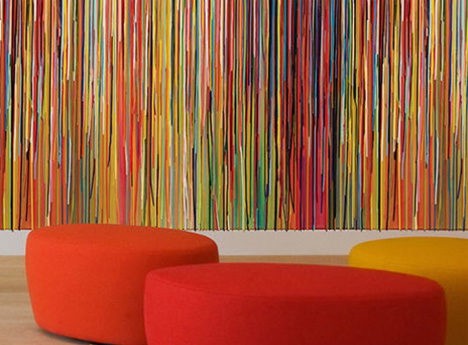
Where is `rainbow curtain`? The width and height of the screenshot is (468, 345). rainbow curtain is located at coordinates (232, 96).